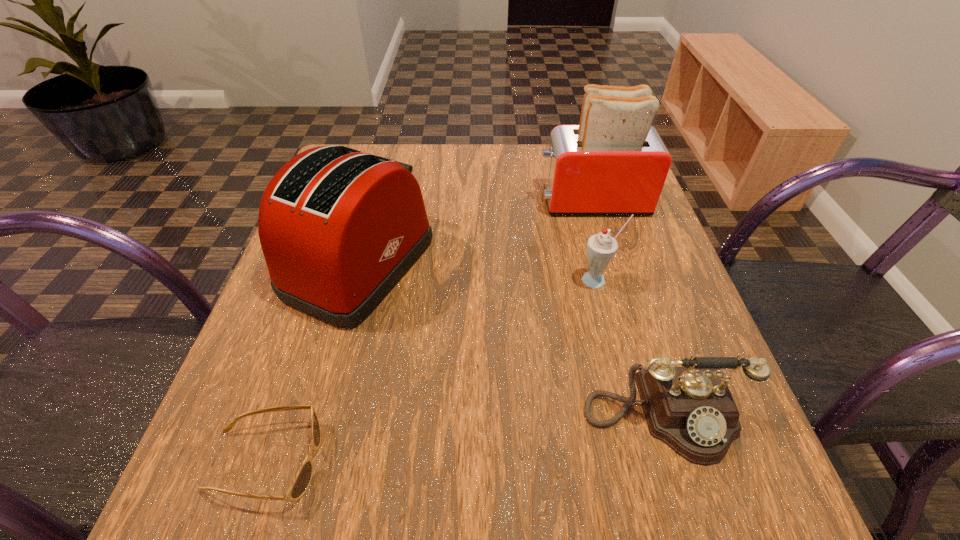
At what (x,y) coordinates should I click in order to perform the action: click on object located at the far right corner. Please return your answer as a coordinate pair (x, y). Looking at the image, I should click on (614, 162).

At what (x,y) coordinates should I click in order to perform the action: click on object that is at the near right corner. Please return your answer as a coordinate pair (x, y). The image size is (960, 540). Looking at the image, I should click on (690, 409).

This screenshot has width=960, height=540. Find the location of `vacant space at the far edge of the desktop`. vacant space at the far edge of the desktop is located at coordinates (522, 192).

This screenshot has width=960, height=540. I want to click on free region at the right edge, so click(x=626, y=234).

The height and width of the screenshot is (540, 960). I want to click on vacant region between the sunglasses and the right toaster, so click(x=429, y=331).

Where is `vacant point located between the sunglasses and the telephone`? This screenshot has height=540, width=960. vacant point located between the sunglasses and the telephone is located at coordinates (465, 438).

At what (x,y) coordinates should I click in order to perform the action: click on free point between the left toaster and the telephone. Please return your answer as a coordinate pair (x, y). The image size is (960, 540). Looking at the image, I should click on (511, 341).

The image size is (960, 540). Identify the location of vacant area that lies between the shortest object and the milkshake. (432, 371).

Identify the location of free point between the left toaster and the shortest object. The width and height of the screenshot is (960, 540). (312, 363).

Locate an element on the screen. Image resolution: width=960 pixels, height=540 pixels. free space between the milkshake and the left toaster is located at coordinates (479, 273).